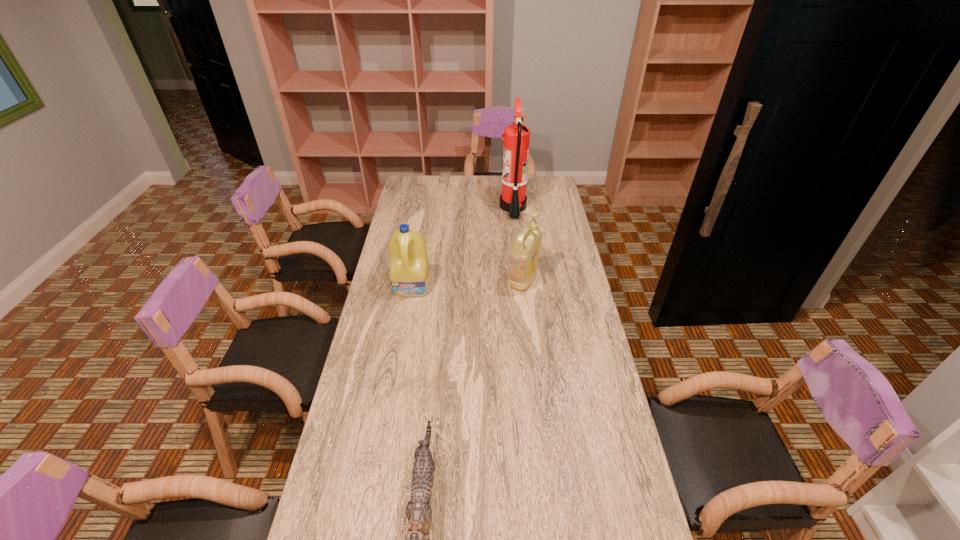
Find the location of `object that can be found as the closest to the farthest object`. object that can be found as the closest to the farthest object is located at coordinates tap(525, 251).

I want to click on object that is the second nearest to the leftmost object, so click(513, 199).

The width and height of the screenshot is (960, 540). Identify the location of vacant space that satisfies the following two spatial constraints: 1. at the nozzle of the fire extinguisher; 2. on the label of the leftmost object. (521, 285).

Find the location of a particular element. The width and height of the screenshot is (960, 540). blank area in the image that satisfies the following two spatial constraints: 1. at the nozzle of the fire extinguisher; 2. on the label of the left detergent is located at coordinates (521, 285).

Locate an element on the screen. free space that satisfies the following two spatial constraints: 1. at the nozzle of the fire extinguisher; 2. on the label of the left detergent is located at coordinates (521, 285).